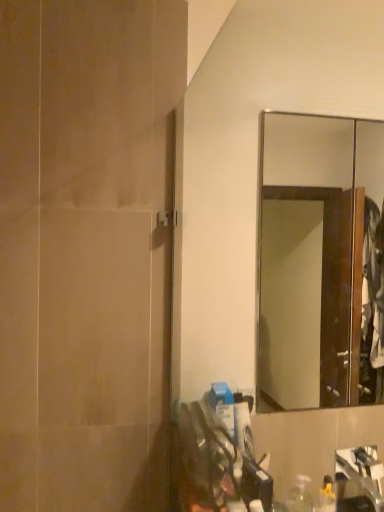
Question: Can you see matte beige screen door at left touching wooden-framed mirror at upper right?

Choices:
 (A) no
 (B) yes

Answer: (A)

Question: Is the depth of matte beige screen door at left greater than that of wooden-framed mirror at upper right?

Choices:
 (A) no
 (B) yes

Answer: (A)

Question: From a real-world perspective, is matte beige screen door at left below wooden-framed mirror at upper right?

Choices:
 (A) yes
 (B) no

Answer: (B)

Question: Are matte beige screen door at left and wooden-framed mirror at upper right far apart?

Choices:
 (A) no
 (B) yes

Answer: (A)

Question: Is matte beige screen door at left positioned before wooden-framed mirror at upper right?

Choices:
 (A) yes
 (B) no

Answer: (A)

Question: Is wooden-framed mirror at upper right at the back of matte beige screen door at left?

Choices:
 (A) yes
 (B) no

Answer: (B)

Question: From a real-world perspective, is wooden-framed mirror at upper right positioned over matte beige screen door at left based on gravity?

Choices:
 (A) no
 (B) yes

Answer: (A)

Question: Does wooden-framed mirror at upper right appear on the right side of matte beige screen door at left?

Choices:
 (A) no
 (B) yes

Answer: (B)

Question: Is wooden-framed mirror at upper right thinner than matte beige screen door at left?

Choices:
 (A) no
 (B) yes

Answer: (A)

Question: From the image's perspective, is wooden-framed mirror at upper right located beneath matte beige screen door at left?

Choices:
 (A) no
 (B) yes

Answer: (B)

Question: Is wooden-framed mirror at upper right placed right next to matte beige screen door at left?

Choices:
 (A) no
 (B) yes

Answer: (A)

Question: Could you tell me if wooden-framed mirror at upper right is facing matte beige screen door at left?

Choices:
 (A) no
 (B) yes

Answer: (A)

Question: Considering the positions of matte beige screen door at left and wooden-framed mirror at upper right in the image, is matte beige screen door at left taller or shorter than wooden-framed mirror at upper right?

Choices:
 (A) short
 (B) tall

Answer: (B)